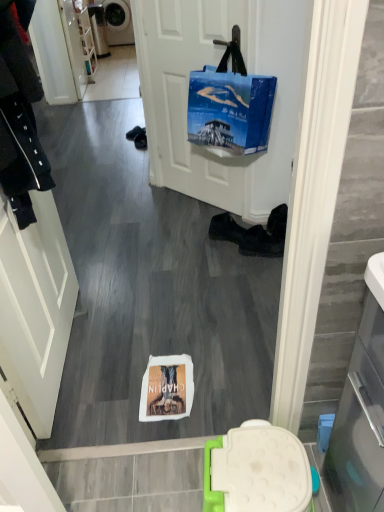
Find the location of a particular element. blank space situated above white paper bag at center (from a real-world perspective) is located at coordinates (156, 381).